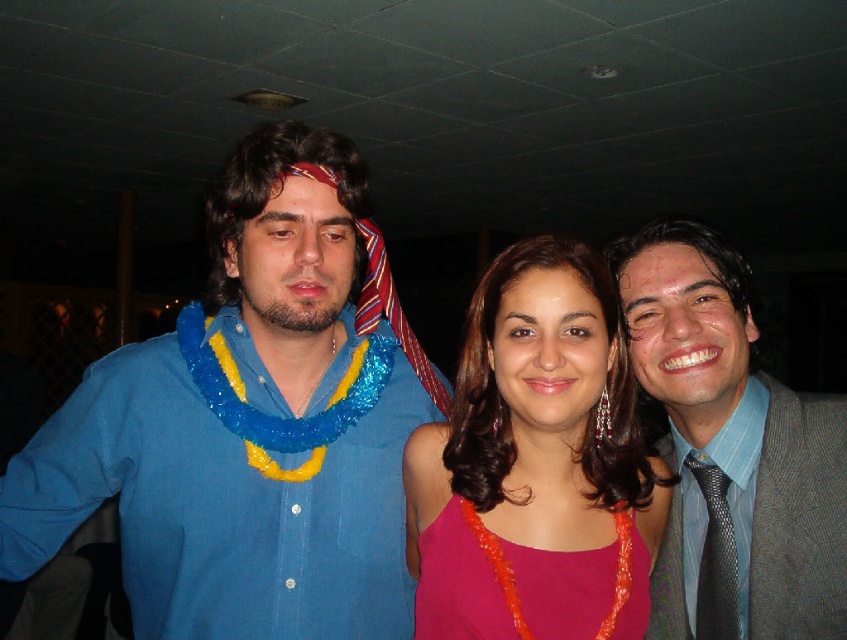
Is blue fabric shirt at left positioned behind pink fabric dress at center?

That is True.

Is blue fabric shirt at left above pink fabric dress at center?

Yes.

What do you see at coordinates (244, 428) in the screenshot?
I see `blue fabric shirt at left` at bounding box center [244, 428].

Where is `blue fabric shirt at left`? The image size is (847, 640). blue fabric shirt at left is located at coordinates (244, 428).

Between pink fabric dress at center and shiny pink fabric dress at center, which one is positioned higher?

pink fabric dress at center is higher up.

Does pink fabric dress at center have a larger size compared to shiny pink fabric dress at center?

Yes.

The image size is (847, 640). What do you see at coordinates (535, 461) in the screenshot?
I see `pink fabric dress at center` at bounding box center [535, 461].

Image resolution: width=847 pixels, height=640 pixels. What are the coordinates of `pink fabric dress at center` in the screenshot? It's located at (535, 461).

From the picture: Does pink fabric dress at center appear over black textured tie at right?

Yes.

What do you see at coordinates (535, 461) in the screenshot? I see `pink fabric dress at center` at bounding box center [535, 461].

Which is in front, point (441, 563) or point (711, 595)?

Point (441, 563)

This screenshot has height=640, width=847. Identify the location of pink fabric dress at center. (535, 461).